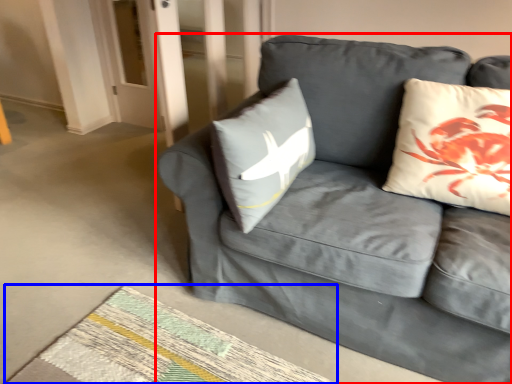
Question: Among these objects, which one is nearest to the camera, studio couch (highlighted by a red box) or mat (highlighted by a blue box)?

Choices:
 (A) studio couch
 (B) mat

Answer: (A)